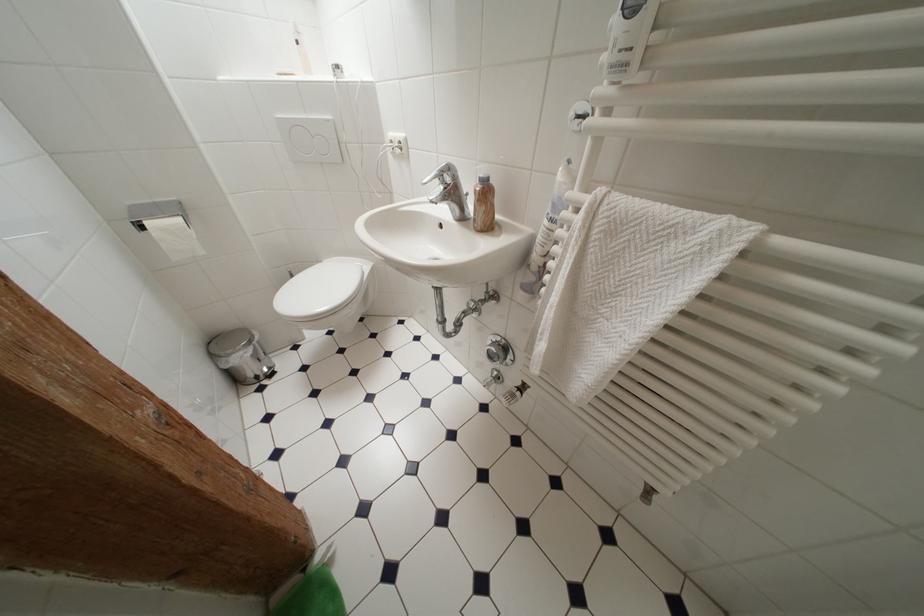
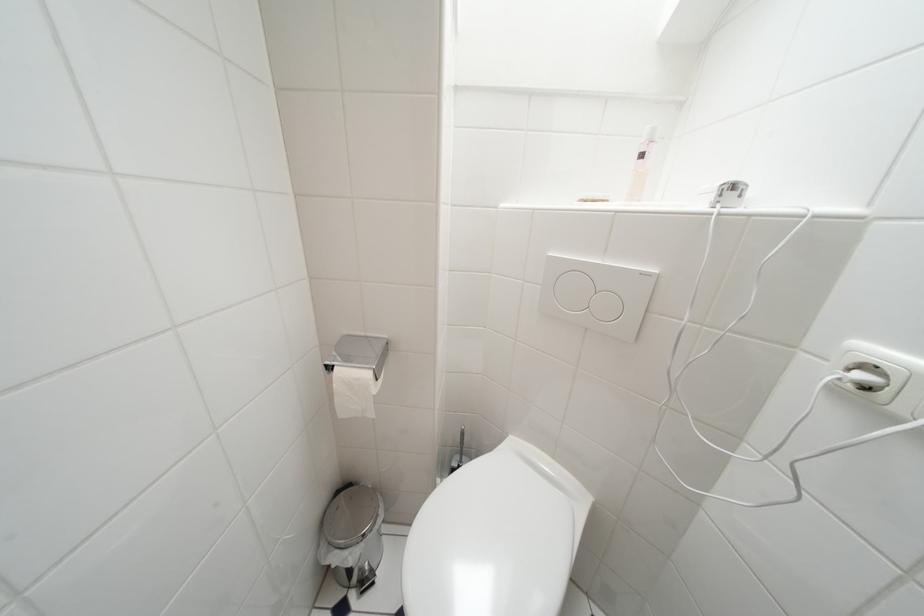
Question: The camera is either moving clockwise (left) or counter-clockwise (right) around the object. The first image is from the beginning of the video and the second image is from the end. Is the camera moving left or right when shooting the video?

Choices:
 (A) Left
 (B) Right

Answer: (B)